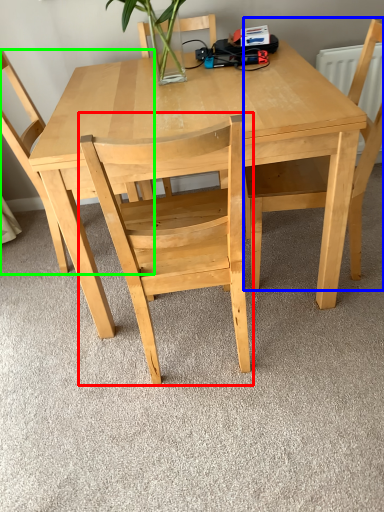
Question: Which is nearer to the chair (highlighted by a red box)? chair (highlighted by a blue box) or chair (highlighted by a green box).

Choices:
 (A) chair
 (B) chair

Answer: (A)